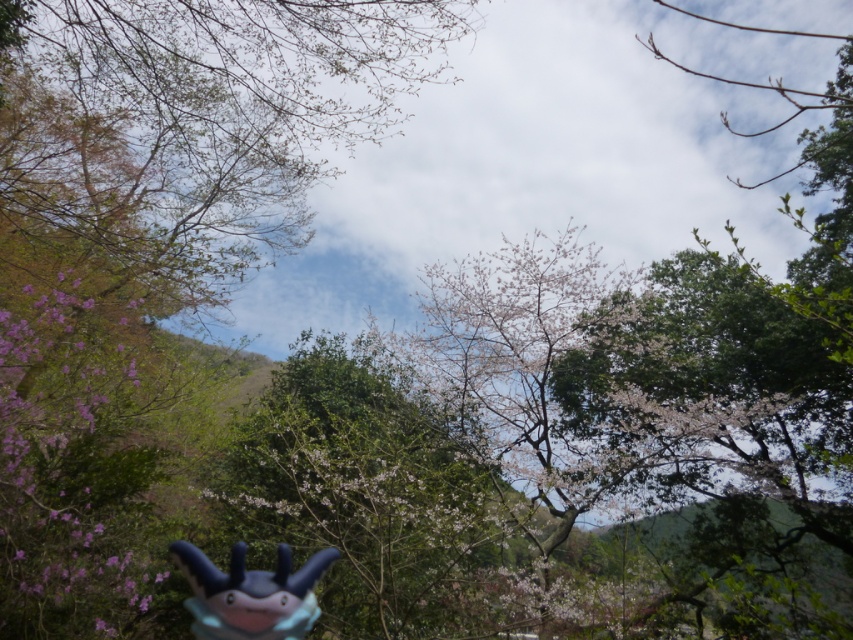
Question: In this image, where is pink matte flower at left located relative to matte blue plush toy at bottom center?

Choices:
 (A) above
 (B) below

Answer: (B)

Question: Among these points, which one is nearest to the camera?

Choices:
 (A) (213, 582)
 (B) (33, 600)

Answer: (A)

Question: Which of the following is the closest to the observer?

Choices:
 (A) coord(61,420)
 (B) coord(302,579)

Answer: (B)

Question: Where is pink matte flower at left located in relation to matte blue plush toy at bottom center in the image?

Choices:
 (A) below
 (B) above

Answer: (A)

Question: Which point appears farthest from the camera in this image?

Choices:
 (A) (221, 598)
 (B) (85, 468)

Answer: (B)

Question: Does pink matte flower at left have a larger size compared to matte blue plush toy at bottom center?

Choices:
 (A) no
 (B) yes

Answer: (A)